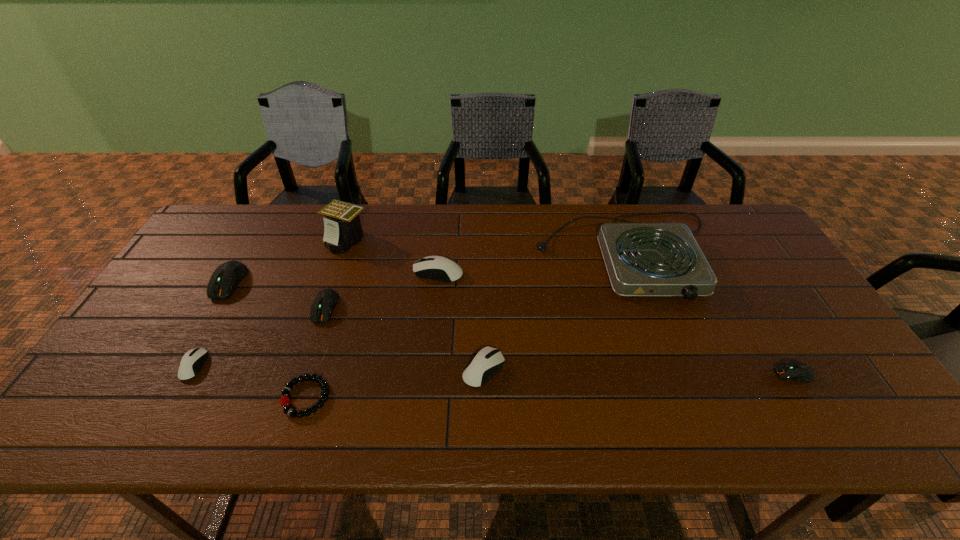
The width and height of the screenshot is (960, 540). I want to click on free space that satisfies the following two spatial constraints: 1. on the front side of the leftmost white mouse; 2. on the right side of the black bracelet, so click(x=177, y=397).